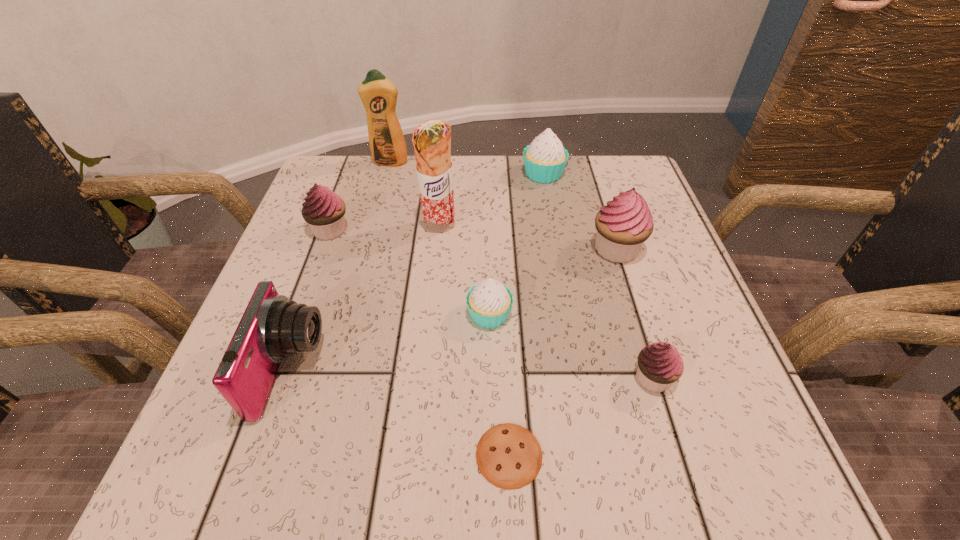
At what (x,y) coordinates should I click in order to perform the action: click on pink cupcake that can be found as the second closest to the seventh object from left to right. Please return your answer as a coordinate pair (x, y). Looking at the image, I should click on (323, 210).

Identify which pink cupcake is the nearest to the cookie. Please provide its 2D coordinates. Your answer should be formatted as a tuple, i.e. [(x, y)], where the tuple contains the x and y coordinates of a point satisfying the conditions above.

[(659, 364)]

The width and height of the screenshot is (960, 540). I want to click on free space that satisfies the following two spatial constraints: 1. on the label of the cookie; 2. on the right side of the detergent, so click(x=313, y=455).

Find the location of a particular element. Image resolution: width=960 pixels, height=540 pixels. vacant space that satisfies the following two spatial constraints: 1. on the front side of the tallest cupcake; 2. on the front-facing side of the camera is located at coordinates (655, 370).

You are a GUI agent. You are given a task and a screenshot of the screen. Output one action in this format:
    pyautogui.click(x=<x>, y=<y>)
    Task: Click on the vacant space that satisfies the following two spatial constraints: 1. on the label of the detergent; 2. on the right side of the burrito
    Image resolution: width=960 pixels, height=540 pixels.
    Given the screenshot: What is the action you would take?
    pyautogui.click(x=372, y=227)